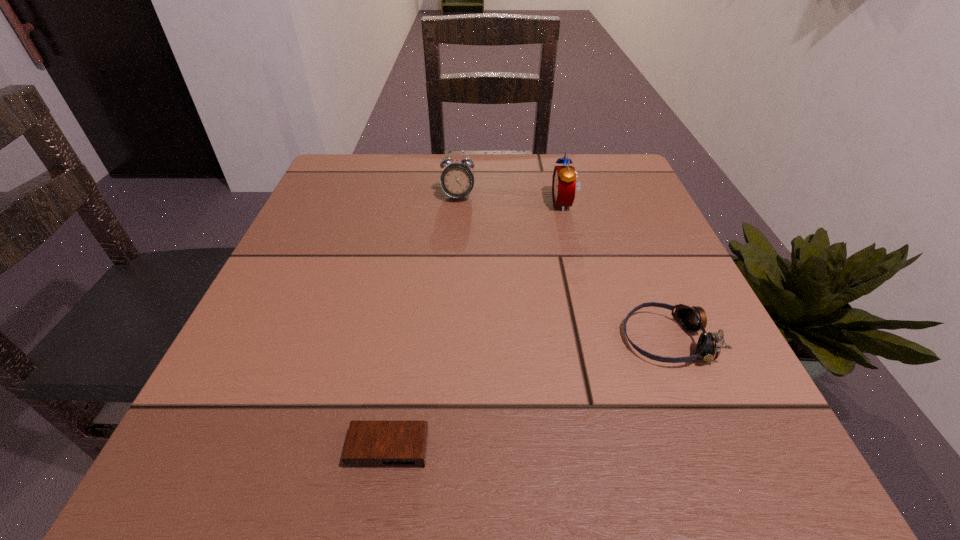
Find the location of a particular element. This screenshot has height=540, width=960. vacant area at the right edge of the desktop is located at coordinates (639, 269).

At what (x,y) coordinates should I click in order to perform the action: click on vacant space at the far left corner. Please return your answer as a coordinate pair (x, y). The width and height of the screenshot is (960, 540). Looking at the image, I should click on (372, 202).

Find the location of a particular element. This screenshot has width=960, height=540. free space that is in between the goggles and the shortest object is located at coordinates (527, 394).

You are a GUI agent. You are given a task and a screenshot of the screen. Output one action in this format:
    pyautogui.click(x=<x>, y=<y>)
    Task: Click on the vacant area between the rightmost object and the second tallest alarm clock
    The width and height of the screenshot is (960, 540).
    Given the screenshot: What is the action you would take?
    pyautogui.click(x=563, y=268)

Where is `free space that is in between the tallest object and the shortest object`? free space that is in between the tallest object and the shortest object is located at coordinates (476, 326).

At what (x,y) coordinates should I click in order to perform the action: click on free space between the second object from right to left and the nearest object. Please return your answer as a coordinate pair (x, y). Looking at the image, I should click on (476, 326).

At what (x,y) coordinates should I click in order to perform the action: click on free spot between the third farthest object and the nearest alarm clock. Please return your answer as a coordinate pair (x, y). Looking at the image, I should click on (527, 394).

The height and width of the screenshot is (540, 960). I want to click on vacant area between the goggles and the second shortest alarm clock, so click(x=563, y=268).

Where is `free area in between the nearest alarm clock and the second nearest object`? The width and height of the screenshot is (960, 540). free area in between the nearest alarm clock and the second nearest object is located at coordinates (527, 394).

I want to click on vacant area that lies between the second object from right to left and the second tallest alarm clock, so click(511, 200).